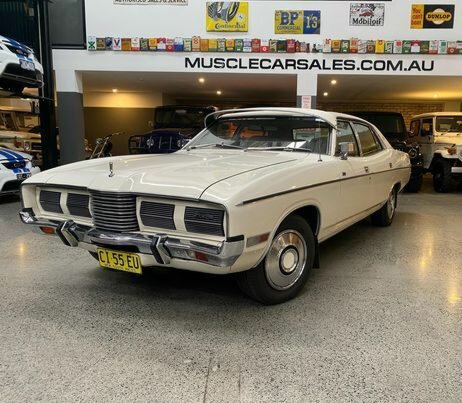
Image resolution: width=462 pixels, height=403 pixels. Find the location of `wall`. wall is located at coordinates (118, 26), (126, 110).